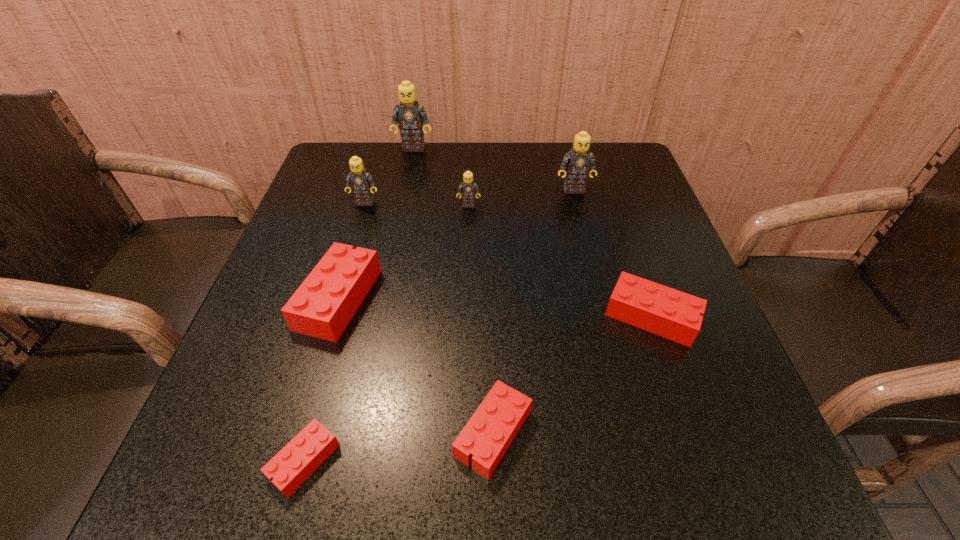
Find the location of a particular element. The image size is (960, 540). the tallest object is located at coordinates point(410,115).

Find the location of a particular element. This screenshot has height=540, width=960. the farthest tan Lego is located at coordinates (410, 115).

The height and width of the screenshot is (540, 960). In order to click on the second tallest object in this screenshot , I will do `click(578, 162)`.

You are a GUI agent. You are given a task and a screenshot of the screen. Output one action in this format:
    pyautogui.click(x=<x>, y=<y>)
    Task: Click on the rightmost tan Lego
    
    Given the screenshot: What is the action you would take?
    pyautogui.click(x=578, y=162)

Where is `the second smallest tan Lego`? The height and width of the screenshot is (540, 960). the second smallest tan Lego is located at coordinates (361, 182).

The image size is (960, 540). I want to click on the third tallest object, so click(361, 182).

At what (x,y) coordinates should I click in order to perform the action: click on the second tan Lego from right to left. Please return your answer as a coordinate pair (x, y). Looking at the image, I should click on (469, 189).

You are a GUI agent. You are given a task and a screenshot of the screen. Output one action in this format:
    pyautogui.click(x=<x>, y=<y>)
    Task: Click on the smallest tan Lego
    This screenshot has height=540, width=960.
    Given the screenshot: What is the action you would take?
    click(469, 189)

Find the location of a particular element. The height and width of the screenshot is (540, 960). the fifth tallest Lego is located at coordinates (323, 305).

Where is `the biggest red Lego`? Image resolution: width=960 pixels, height=540 pixels. the biggest red Lego is located at coordinates (323, 305).